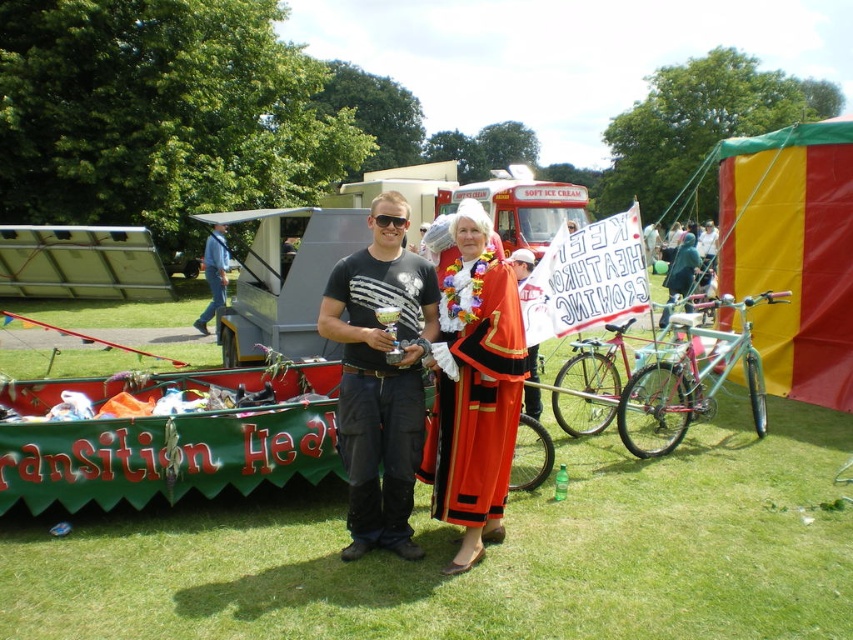
Question: Which point is farther from the camera taking this photo?

Choices:
 (A) (387, 387)
 (B) (454, 381)

Answer: (B)

Question: Among these objects, which one is farthest from the camera?

Choices:
 (A) pink metallic bicycle at center-right
 (B) teal matte bicycle at right

Answer: (A)

Question: Does matte black t-shirt at center appear on the left side of pink metallic bicycle at center-right?

Choices:
 (A) yes
 (B) no

Answer: (A)

Question: Based on their relative distances, which object is farther from the blue jeans at left?

Choices:
 (A) matte black t-shirt at center
 (B) pink metallic bicycle at center-right

Answer: (A)

Question: Does orange satin robe at center lie in front of blue jeans at left?

Choices:
 (A) yes
 (B) no

Answer: (A)

Question: Does matte black t-shirt at center appear under orange satin robe at center?

Choices:
 (A) no
 (B) yes

Answer: (A)